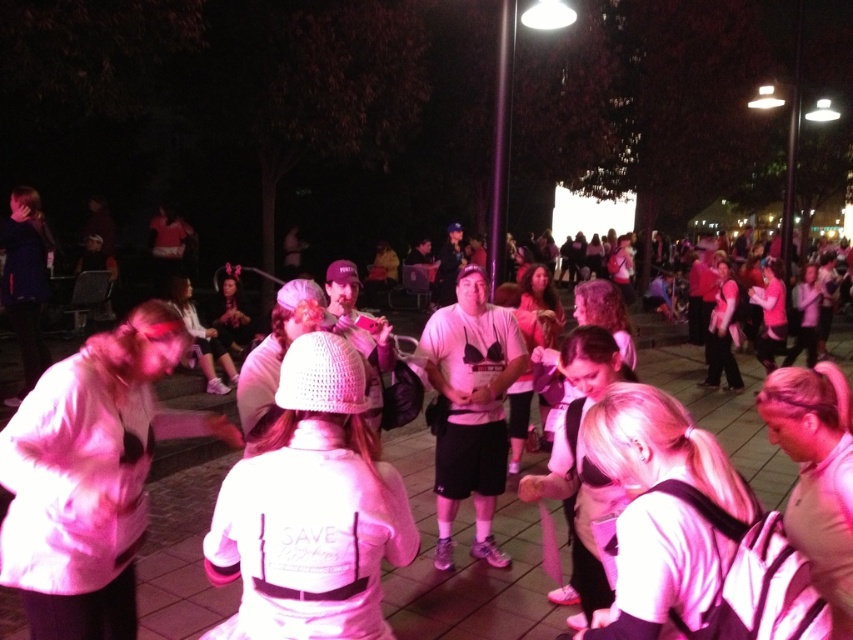
Is white knitted hat at center above white matte t-shirt at center?

Correct, white knitted hat at center is located above white matte t-shirt at center.

Is point (265, 474) behind point (445, 362)?

No, (265, 474) is closer to viewer.

Does point (254, 449) come closer to viewer compared to point (503, 429)?

That is True.

Find the location of a particular element. white knitted hat at center is located at coordinates (310, 509).

Is point (747, 461) less distant than point (502, 328)?

No, it is not.

Between white matte jacket at center and white matte t-shirt at center, which one appears on the left side from the viewer's perspective?

white matte t-shirt at center

Who is more forward, [418,483] or [497,464]?

Point [497,464]

Locate an element on the screen. The height and width of the screenshot is (640, 853). white matte jacket at center is located at coordinates (466, 564).

From the picture: Who is lower down, white matte jacket at center or white fuzzy jacket at lower left?

Positioned lower is white matte jacket at center.

Between white matte jacket at center and white fuzzy jacket at lower left, which one has less height?

white matte jacket at center

Between point (486, 573) and point (120, 529), which one is positioned in front?

Point (120, 529) is in front.

Locate an element on the screen. white matte jacket at center is located at coordinates pyautogui.click(x=466, y=564).